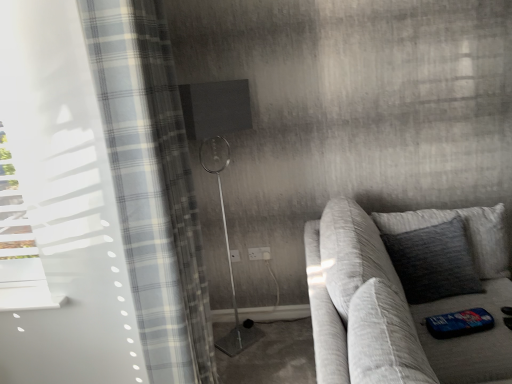
Question: In the image, is matte black shower at center positioned in front of or behind white plastic electric outlet at center, which is the 1th electric outlet in left-to-right order?

Choices:
 (A) behind
 (B) front

Answer: (B)

Question: Is matte black shower at center to the left or to the right of white plastic electric outlet at center, which is counted as the second electric outlet, starting from the right, in the image?

Choices:
 (A) right
 (B) left

Answer: (B)

Question: Which object is positioned farthest from the textured gray pillow at right?

Choices:
 (A) matte black shower at center
 (B) textured gray couch at right
 (C) white plastic electric outlet at center, which ranks as the first electric outlet in right-to-left order
 (D) translucent plaid curtain at left
 (E) white plastic electric outlet at center, which is counted as the second electric outlet, starting from the right

Answer: (A)

Question: Which object is the closest to the white plastic electric outlet at center, which ranks as the first electric outlet in right-to-left order?

Choices:
 (A) translucent plaid curtain at left
 (B) white plastic electric outlet at center, which is the 1th electric outlet in left-to-right order
 (C) matte black shower at center
 (D) textured gray couch at right
 (E) textured gray pillow at right

Answer: (B)